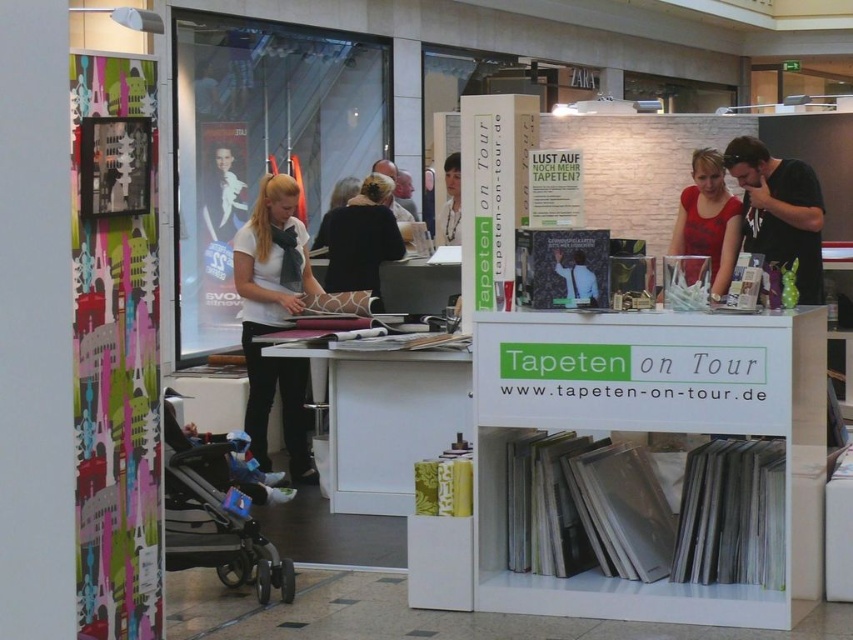
Question: Which point is farther to the camera?

Choices:
 (A) (361, 250)
 (B) (695, 262)
 (C) (352, 490)
 (D) (264, 323)

Answer: (A)

Question: Is black plastic baby carriage at lower left positioned before black leather jacket at center?

Choices:
 (A) yes
 (B) no

Answer: (A)

Question: Based on their relative distances, which object is nearer to the white fabric shirt at upper center?

Choices:
 (A) white glossy desk at lower center
 (B) black plastic baby carriage at lower left
 (C) black leather jacket at center
 (D) black matte shirt at upper right

Answer: (C)

Question: Is white glossy desk at lower center below matte red blouse at center?

Choices:
 (A) no
 (B) yes

Answer: (B)

Question: Which object appears closest to the camera in this image?

Choices:
 (A) black plastic baby carriage at lower left
 (B) matte red blouse at center

Answer: (A)

Question: Does black leather jacket at center come behind white fabric shirt at upper center?

Choices:
 (A) yes
 (B) no

Answer: (B)